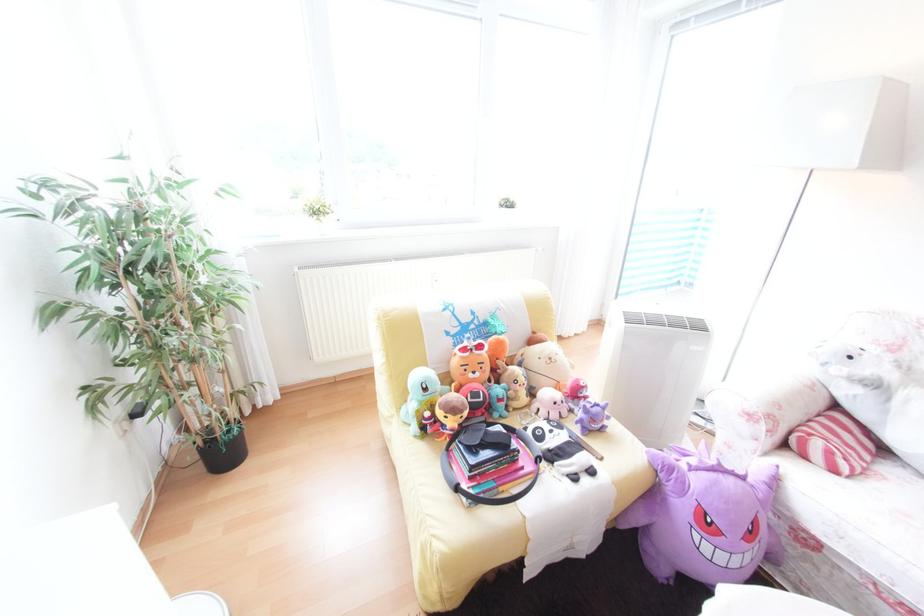
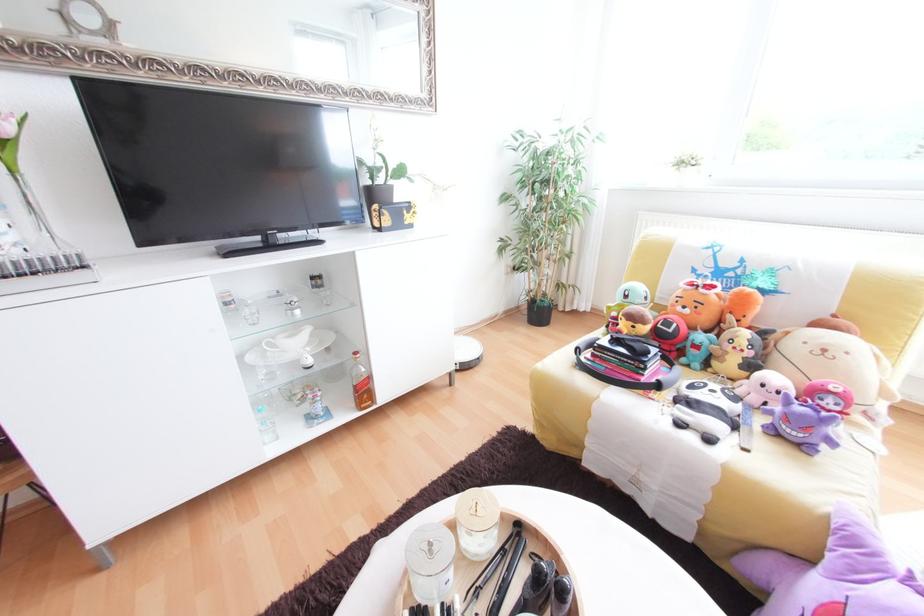
The point at (x=507, y=400) is marked in the first image. Where is the corresponding point in the second image?

(704, 347)